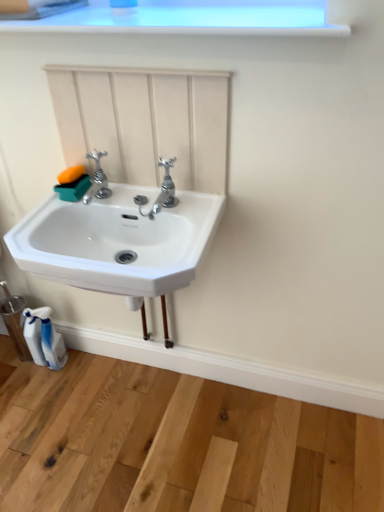
The image size is (384, 512). I want to click on vacant space situated on the left part of polished chrome faucet at center, the first tap positioned from the right, so click(x=113, y=204).